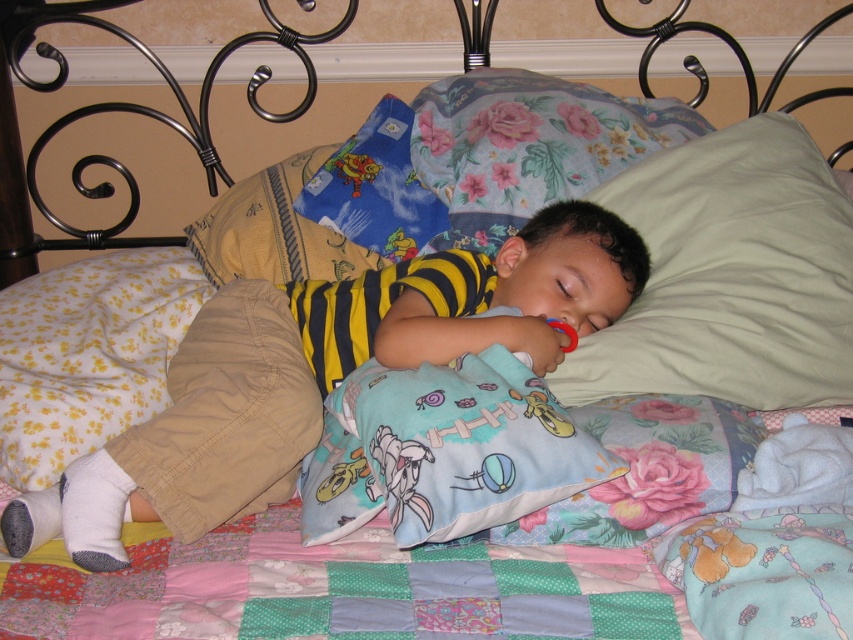
You are a photographer standing at the corner of the room. You want to take a photo of the patchwork quilt at center. According to the coordinates provided, where should you aim your camera to capture the quilt in the frame?

The patchwork quilt at center is located at coordinates point (339, 588), so you should aim your camera towards that point to capture it in the frame.

You are standing in the room and want to place a small nightlight. You have two options for placement based on coordinates given in the image. The first option is at point (33, 586), and the second is at point (351, 502). Which point is closer to you?

Point (33, 586) is closer to the viewer than point (351, 502), so the first option is closer.

You are taking a photo of the sleeping child and notice two points in the image, point 1 at coordinates point (103, 81) and point 2 at coordinates point (514, 401). Which point is closer to the camera?

Point 1 at coordinates point (103, 81) is closer to the camera than point 2 at coordinates point (514, 401).